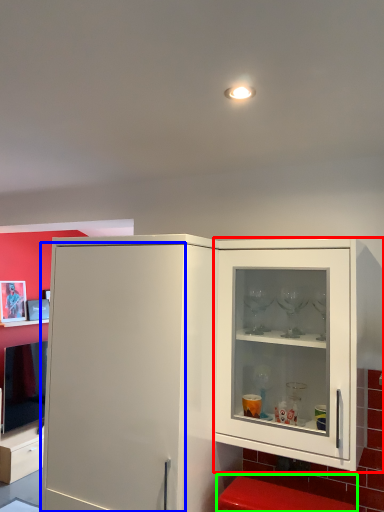
Question: Which object is positioned farthest from cupboard (highlighted by a red box)? Select from door (highlighted by a blue box) and step stool (highlighted by a green box).

Choices:
 (A) door
 (B) step stool

Answer: (A)